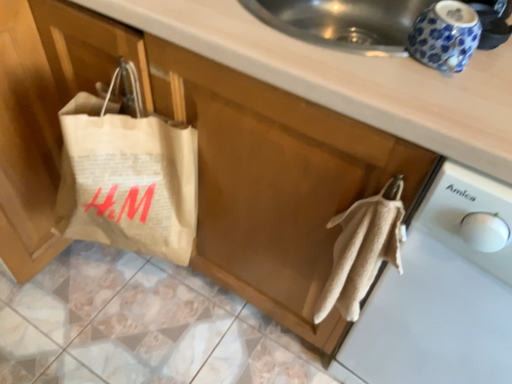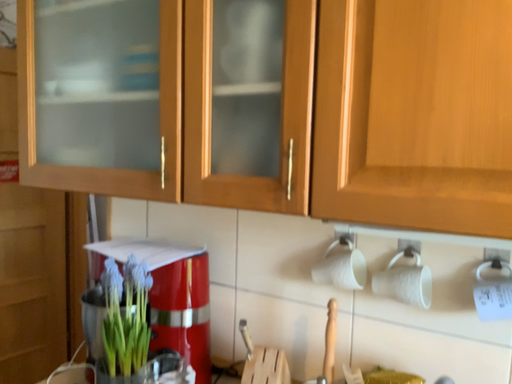
Question: Which way did the camera rotate in the video?

Choices:
 (A) rotated downward
 (B) rotated upward

Answer: (B)